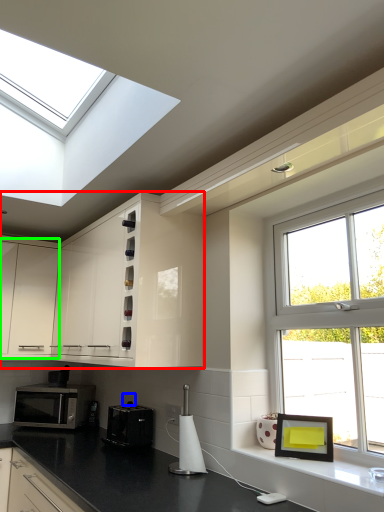
Question: Which object is the closest to the cabinetry (highlighted by a red box)? Choose among these: electric outlet (highlighted by a blue box) or cabinetry (highlighted by a green box).

Choices:
 (A) electric outlet
 (B) cabinetry

Answer: (B)